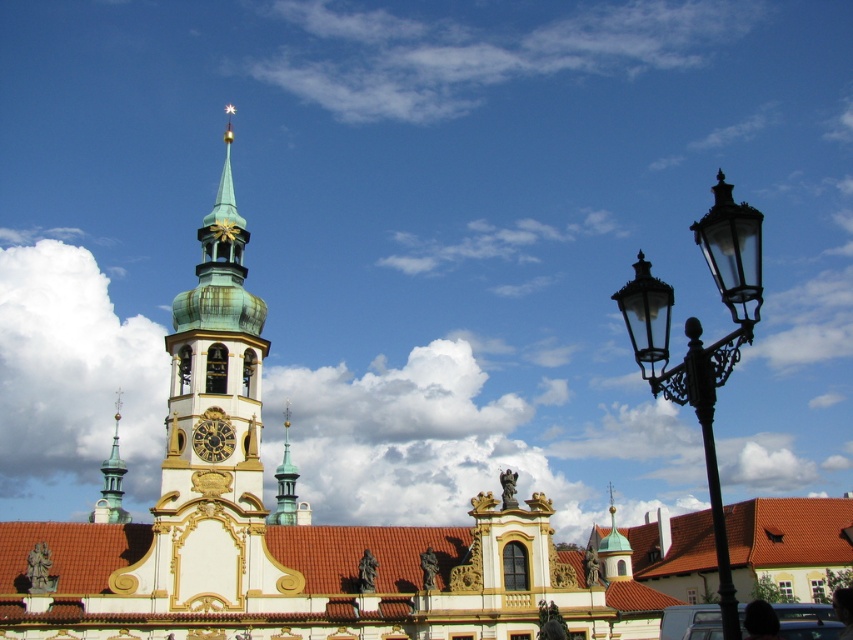
Is green copper tower at center above gold textured dome at center?

Correct, green copper tower at center is located above gold textured dome at center.

Does green copper tower at center have a larger size compared to gold textured dome at center?

Yes, green copper tower at center is bigger than gold textured dome at center.

Who is more distant from viewer, (192, 467) or (614, 509)?

The point (614, 509) is more distant.

I want to click on green copper tower at center, so [x=216, y=353].

Can you confirm if gold ornate church at center is positioned above gold/brass/decorativeclock at center?

No, gold ornate church at center is not above gold/brass/decorativeclock at center.

In the scene shown: Can you confirm if gold ornate church at center is thinner than gold/brass/decorativeclock at center?

Incorrect, gold ornate church at center's width is not less than gold/brass/decorativeclock at center's.

What do you see at coordinates (288, 525) in the screenshot? This screenshot has width=853, height=640. I see `gold ornate church at center` at bounding box center [288, 525].

Image resolution: width=853 pixels, height=640 pixels. In order to click on gold ornate church at center in this screenshot , I will do `click(288, 525)`.

Is gold ornate church at center taller than gold textured dome at center?

Yes, gold ornate church at center is taller than gold textured dome at center.

Who is positioned more to the right, gold ornate church at center or gold textured dome at center?

Positioned to the right is gold textured dome at center.

Between point (230, 404) and point (616, 561), which one is positioned in front?

Point (230, 404)

Where is `gold ornate church at center`? Image resolution: width=853 pixels, height=640 pixels. gold ornate church at center is located at coordinates (288, 525).